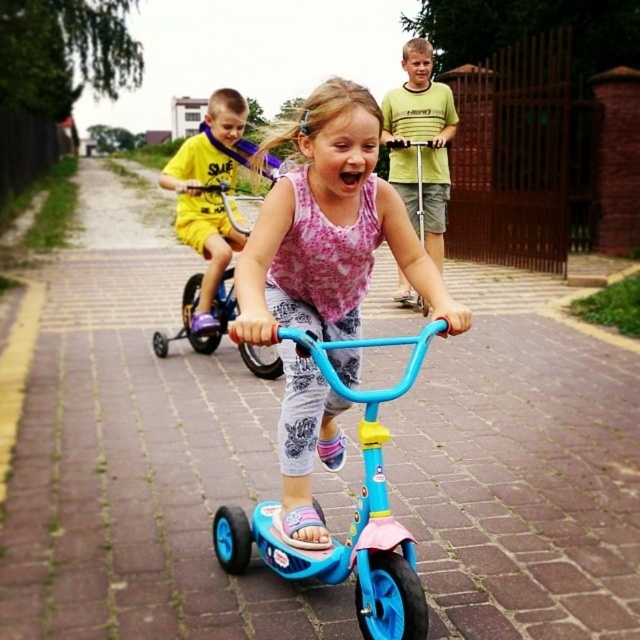
Question: Is blue plastic tricycle at center wider than blue plastic bicycle at center?

Choices:
 (A) yes
 (B) no

Answer: (B)

Question: Is blue plastic bicycle at center further to camera compared to blue plastic scooter at center?

Choices:
 (A) yes
 (B) no

Answer: (B)

Question: Is pink fabric shirt at center above yellow matte shirt at upper left?

Choices:
 (A) yes
 (B) no

Answer: (B)

Question: Which object is the closest to the pink fabric shirt at center?

Choices:
 (A) blue plastic bicycle at center
 (B) blue plastic scooter at center
 (C) yellow matte shirt at upper left
 (D) blue plastic tricycle at center

Answer: (D)

Question: Among these points, which one is nearest to the camera?

Choices:
 (A) (417, 593)
 (B) (196, 275)
 (C) (420, 180)

Answer: (A)

Question: Which is farther from the yellow matte shirt at upper left?

Choices:
 (A) pink fabric shirt at center
 (B) blue plastic scooter at center
 (C) blue plastic tricycle at center
 (D) blue plastic bicycle at center

Answer: (C)